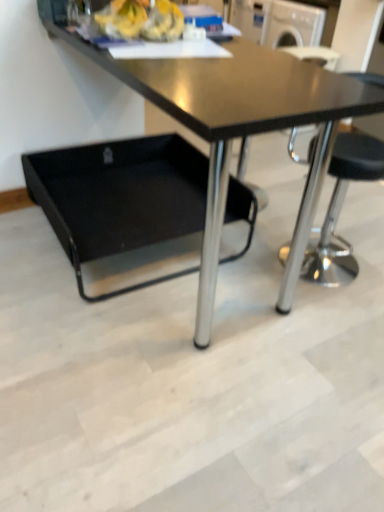
Question: Is black plastic swivel chair at lower left in front of or behind black glossy table at center in the image?

Choices:
 (A) front
 (B) behind

Answer: (B)

Question: Based on their sizes in the image, would you say black plastic swivel chair at lower left is bigger or smaller than black glossy table at center?

Choices:
 (A) small
 (B) big

Answer: (A)

Question: From the image's perspective, relative to black glossy table at center, is black plastic swivel chair at lower left above or below?

Choices:
 (A) below
 (B) above

Answer: (A)

Question: Considering the positions of black glossy table at center and black plastic swivel chair at lower left in the image, is black glossy table at center bigger or smaller than black plastic swivel chair at lower left?

Choices:
 (A) big
 (B) small

Answer: (A)

Question: In terms of height, does black glossy table at center look taller or shorter compared to black plastic swivel chair at lower left?

Choices:
 (A) short
 (B) tall

Answer: (B)

Question: Choose the correct answer: Is black glossy table at center inside black plastic swivel chair at lower left or outside it?

Choices:
 (A) outside
 (B) inside

Answer: (A)

Question: Considering the positions of point (377, 105) and point (165, 190), is point (377, 105) closer or farther from the camera than point (165, 190)?

Choices:
 (A) farther
 (B) closer

Answer: (B)